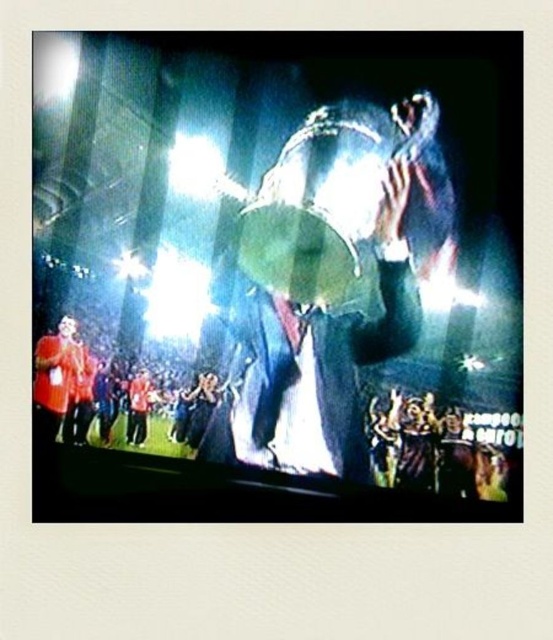
You are a photographer at the event and want to ensure both the metallic trophy at center and the shiny silver drum at center are clearly visible in your photo. Given their sizes, which object should you focus on first to ensure proper framing?

The metallic trophy at center has a smaller size compared to shiny silver drum at center, so you should focus on the shiny silver drum at center first to ensure proper framing since it is larger and might require more attention in the composition.

Based on the photo, you are a photographer who needs to adjust your camera focus to capture the metallic trophy at center clearly. Given that the camera focuses on the center point at coordinates 0.5, 0.5, will the trophy be in focus?

The metallic trophy at center is positioned at point (x=276, y=275), which is very close to the camera focus point at (x=276, y=320). Therefore, the trophy will be in focus.

You are a photographer standing at the camera position. You want to take a closeup shot of the metallic trophy at center. The camera has a maximum zoom range of 5 meters. Can you get a close enough shot to capture the trophy clearly?

The metallic trophy at center is 6.34 meters away from camera. Since the camera can only zoom up to 5 meters, you cannot get a close enough shot to capture the trophy clearly without moving closer.